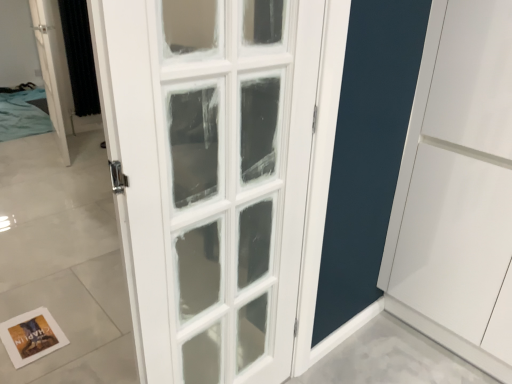
The image size is (512, 384). Find the location of `vacant area that lies to the right of white paper postcard at lower left`. vacant area that lies to the right of white paper postcard at lower left is located at coordinates (80, 353).